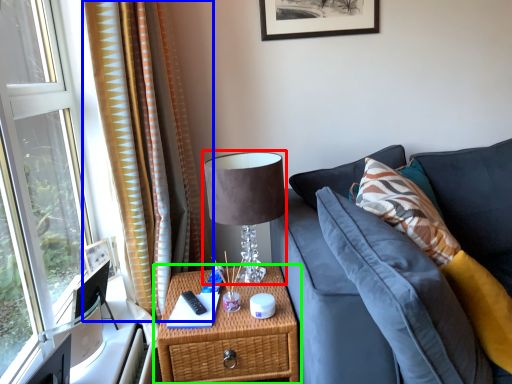
Question: Considering the real-world distances, which object is farthest from table lamp (highlighted by a red box)? curtain (highlighted by a blue box) or nightstand (highlighted by a green box)?

Choices:
 (A) curtain
 (B) nightstand

Answer: (A)